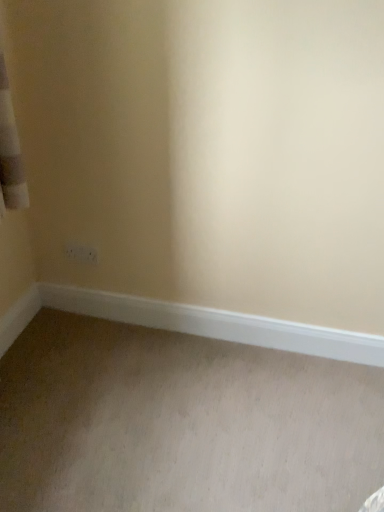
Locate an element on the screen. blank space above white smooth baseboard at lower center (from a real-world perspective) is located at coordinates (210, 308).